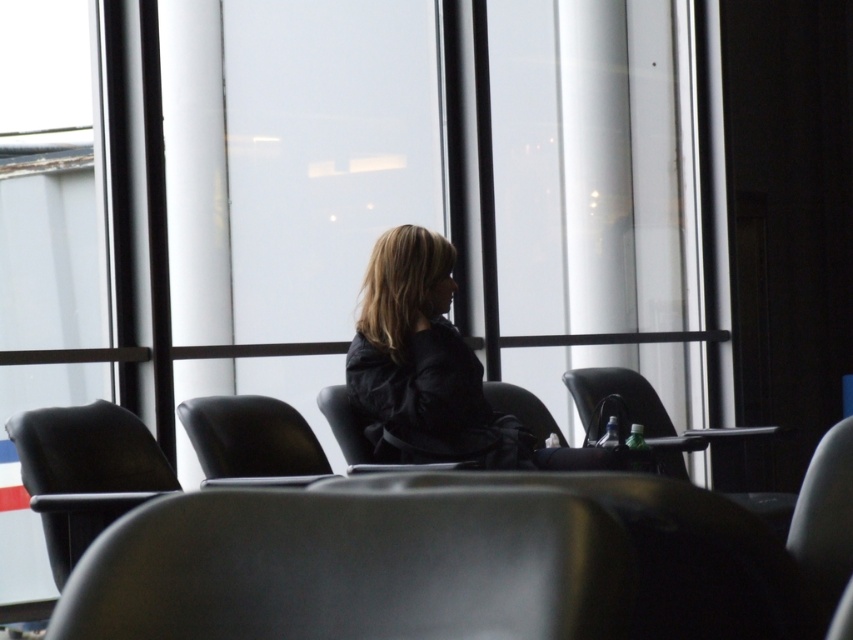
You are standing in the waiting area and see two points marked on the floor. The first point is labeled as point (x=485, y=444) and the second is point (x=625, y=392). If you were to walk from the first point to the second, would you be moving towards the window or away from it?

Since point (x=485, y=444) is in front of point (x=625, y=392), moving from the first point to the second would mean walking away from the window.

You are a person who is 1.8 meters tall and want to sit in one of the chairs in the scene. Which chair would allow you to sit without hitting your head on the ceiling? Please choose between the matte black armchair at left and the black leather armchair at center.

The matte black armchair at left is much taller than the black leather armchair at center, so the black leather armchair at center would allow you to sit without hitting your head on the ceiling since it is shorter.